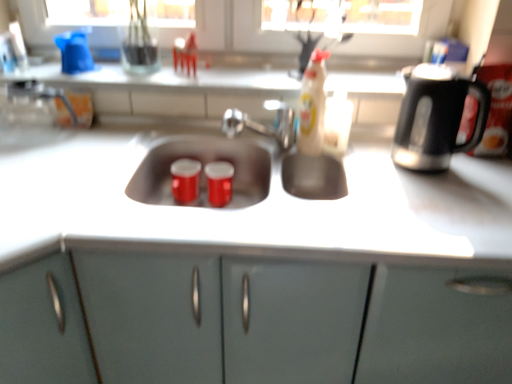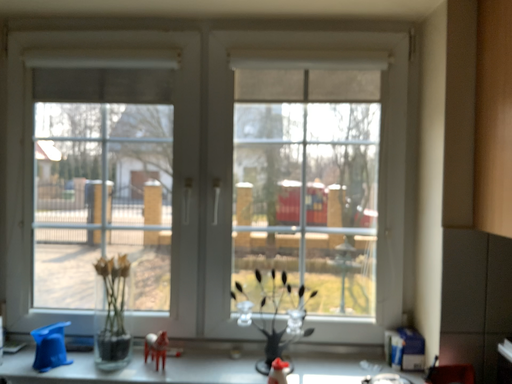
Question: How did the camera likely rotate when shooting the video?

Choices:
 (A) rotated upward
 (B) rotated downward

Answer: (A)